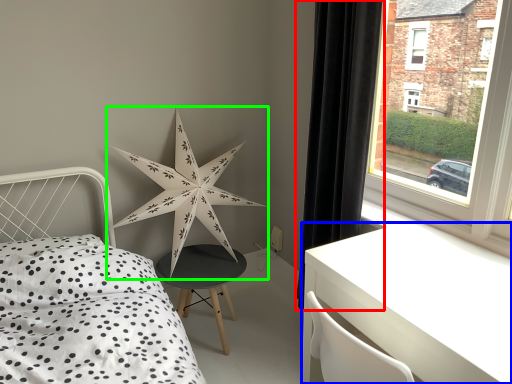
Question: Estimate the real-world distances between objects in this image. Which object is farther from curtain (highlighted by a red box), table (highlighted by a blue box) or star (highlighted by a green box)?

Choices:
 (A) table
 (B) star

Answer: (B)